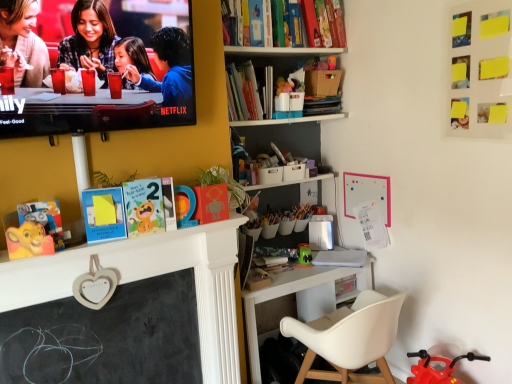
Question: Which direction should I rotate to look at hardcover book at upper center, which ranks as the 1th book in top-to-bottom order, — up or down?

Choices:
 (A) up
 (B) down

Answer: (A)

Question: Is black chalkboard at center-left taller than green matte toy at center?

Choices:
 (A) yes
 (B) no

Answer: (A)

Question: Is black chalkboard at center-left looking in the opposite direction of green matte toy at center?

Choices:
 (A) no
 (B) yes

Answer: (A)

Question: Is black chalkboard at center-left not close to green matte toy at center?

Choices:
 (A) yes
 (B) no

Answer: (A)

Question: Could green matte toy at center be considered to be inside black chalkboard at center-left?

Choices:
 (A) yes
 (B) no

Answer: (B)

Question: Can you confirm if black chalkboard at center-left is thinner than green matte toy at center?

Choices:
 (A) no
 (B) yes

Answer: (B)

Question: Is black chalkboard at center-left at the right side of green matte toy at center?

Choices:
 (A) no
 (B) yes

Answer: (A)

Question: From the image's perspective, is white paper at desk center, the 3th book from the top, above white plastic chair at lower right?

Choices:
 (A) yes
 (B) no

Answer: (A)

Question: Is white paper at desk center, the 3th book from the top, closer to camera compared to white plastic chair at lower right?

Choices:
 (A) yes
 (B) no

Answer: (B)

Question: Are white paper at desk center, the 1th book when ordered from bottom to top, and white plastic chair at lower right far apart?

Choices:
 (A) yes
 (B) no

Answer: (B)

Question: Is the position of white paper at desk center, the 1th book when ordered from bottom to top, more distant than that of white plastic chair at lower right?

Choices:
 (A) yes
 (B) no

Answer: (A)

Question: Is white plastic chair at lower right at the back of white paper at desk center, the 3th book from the top?

Choices:
 (A) yes
 (B) no

Answer: (B)

Question: From a real-world perspective, does white paper at desk center, the 1th book when ordered from bottom to top, stand above white plastic chair at lower right?

Choices:
 (A) no
 (B) yes

Answer: (B)

Question: Is white paper at desk center, the 3th book from the top, located within matte black laptop at upper left?

Choices:
 (A) yes
 (B) no

Answer: (B)